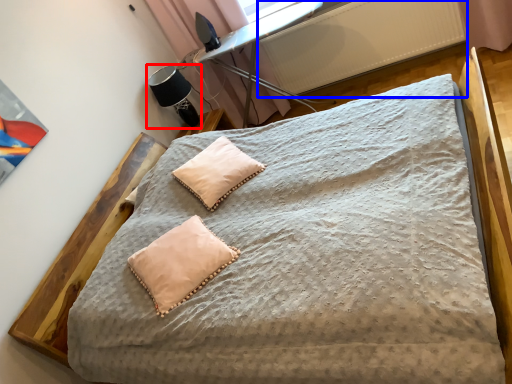
Question: Which object is closer to the camera taking this photo, table lamp (highlighted by a red box) or radiator (highlighted by a blue box)?

Choices:
 (A) table lamp
 (B) radiator

Answer: (B)